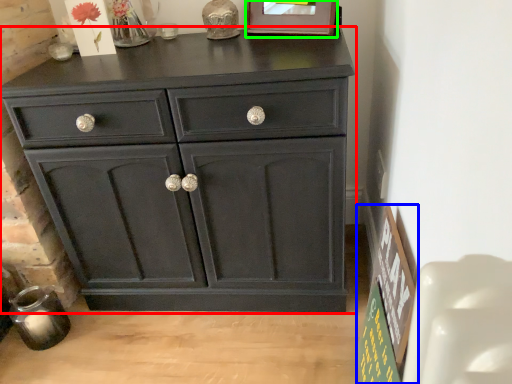
Question: Estimate the real-world distances between objects in this image. Which object is closer to chest of drawers (highlighted by a red box), bulletin board (highlighted by a blue box) or picture frame (highlighted by a green box)?

Choices:
 (A) bulletin board
 (B) picture frame

Answer: (A)